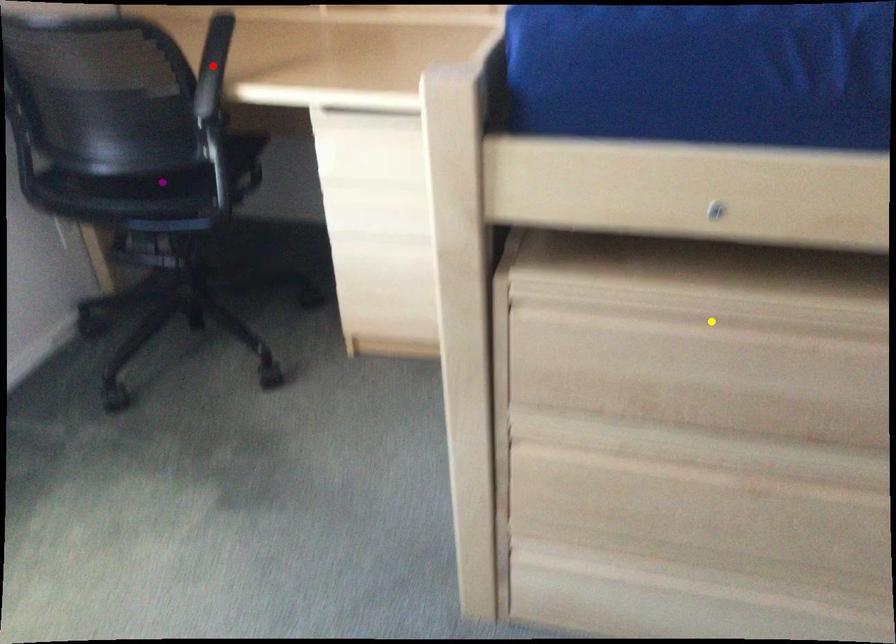
Order these from nearest to farthest:
A) red point
B) purple point
C) yellow point

purple point < red point < yellow point